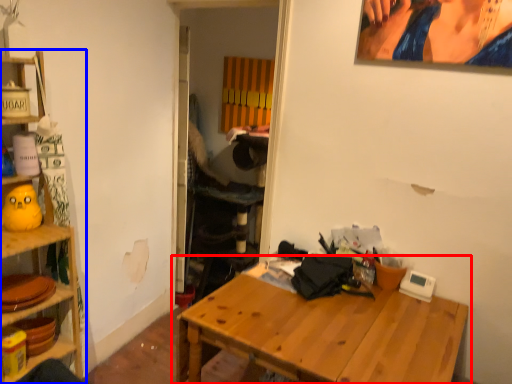
Question: Which of the following is the farthest to the observer, table (highlighted by a red box) or shelf (highlighted by a blue box)?

Choices:
 (A) table
 (B) shelf

Answer: (B)